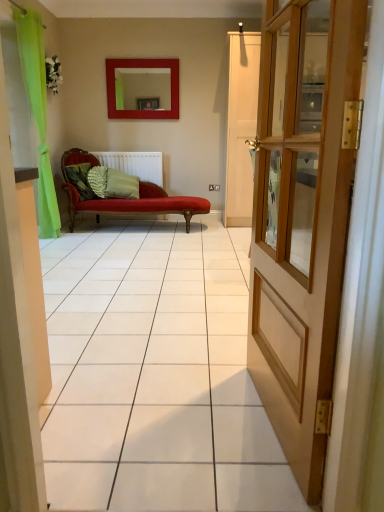
The image size is (384, 512). What do you see at coordinates (135, 164) in the screenshot?
I see `white matte radiator at center` at bounding box center [135, 164].

Image resolution: width=384 pixels, height=512 pixels. What do you see at coordinates (80, 180) in the screenshot?
I see `camouflage fabric pillow at center, the 1th pillow from the left` at bounding box center [80, 180].

Where is `matte red mirror at upper center`? This screenshot has height=512, width=384. matte red mirror at upper center is located at coordinates (142, 67).

What do you see at coordinates (142, 67) in the screenshot? This screenshot has width=384, height=512. I see `matte red mirror at upper center` at bounding box center [142, 67].

What do you see at coordinates (303, 217) in the screenshot? The height and width of the screenshot is (512, 384). I see `wooden door at right` at bounding box center [303, 217].

The width and height of the screenshot is (384, 512). Find the location of `white matte radiator at center`. white matte radiator at center is located at coordinates (135, 164).

The height and width of the screenshot is (512, 384). Find the location of `pillow that is the 3rd object to the left of the wooden door at right, starting at the anchor`. pillow that is the 3rd object to the left of the wooden door at right, starting at the anchor is located at coordinates (80, 180).

Visually, is wooden door at right positioned to the left or to the right of camouflage fabric pillow at center, which appears as the third pillow when viewed from the right?

Clearly, wooden door at right is on the right of camouflage fabric pillow at center, which appears as the third pillow when viewed from the right, in the image.

Does wooden door at right contain camouflage fabric pillow at center, the 1th pillow from the left?

No, wooden door at right does not contain camouflage fabric pillow at center, the 1th pillow from the left.

In the scene shown: Considering the sizes of objects wooden door at right and camouflage fabric pillow at center, which appears as the third pillow when viewed from the right, in the image provided, who is wider, wooden door at right or camouflage fabric pillow at center, which appears as the third pillow when viewed from the right,?

camouflage fabric pillow at center, which appears as the third pillow when viewed from the right.

At what (x,y) coordinates should I click in order to perform the action: click on pillow behind the green textured pillow at center, the second pillow from the left. Please return your answer as a coordinate pair (x, y). Image resolution: width=384 pixels, height=512 pixels. Looking at the image, I should click on (121, 185).

From a real-world perspective, is green textured pillow at center, the second pillow in the right-to-left sequence, on green fabric pillow at center, the first pillow in the right-to-left sequence?

No.

Does green textured pillow at center, the second pillow from the left, come in front of green fabric pillow at center, positioned as the 3th pillow in left-to-right order?

Yes, it is in front of green fabric pillow at center, positioned as the 3th pillow in left-to-right order.

How many degrees apart are the facing directions of green textured pillow at center, the second pillow from the left, and green fabric pillow at center, positioned as the 3th pillow in left-to-right order?

They differ by 40.8 degrees in their facing directions.

Is matte red mirror at upper center bigger or smaller than green fabric pillow at center, positioned as the 3th pillow in left-to-right order?

matte red mirror at upper center is smaller than green fabric pillow at center, positioned as the 3th pillow in left-to-right order.

Which of these two, matte red mirror at upper center or green fabric pillow at center, positioned as the 3th pillow in left-to-right order, stands shorter?

green fabric pillow at center, positioned as the 3th pillow in left-to-right order, is shorter.

Is matte red mirror at upper center facing towards green fabric pillow at center, positioned as the 3th pillow in left-to-right order?

No, matte red mirror at upper center is not aimed at green fabric pillow at center, positioned as the 3th pillow in left-to-right order.

Would you say green fabric pillow at center, positioned as the 3th pillow in left-to-right order, is part of matte red mirror at upper center's contents?

No, green fabric pillow at center, positioned as the 3th pillow in left-to-right order, is not a part of matte red mirror at upper center.

In the image, is white matte radiator at center positioned in front of or behind matte red mirror at upper center?

Visually, white matte radiator at center is located behind matte red mirror at upper center.

You are a GUI agent. You are given a task and a screenshot of the screen. Output one action in this format:
    pyautogui.click(x=<x>, y=<y>)
    Task: Click on the mirror on the right of white matte radiator at center
    The width and height of the screenshot is (384, 512).
    Given the screenshot: What is the action you would take?
    pyautogui.click(x=142, y=67)

Is white matte radiator at center with matte red mirror at upper center?

white matte radiator at center and matte red mirror at upper center are clearly separated.

From the image's perspective, would you say green fabric pillow at center, the first pillow in the right-to-left sequence, is shown under white matte radiator at center?

Yes.

Could you tell me if green fabric pillow at center, positioned as the 3th pillow in left-to-right order, is turned towards white matte radiator at center?

No, green fabric pillow at center, positioned as the 3th pillow in left-to-right order, is not oriented towards white matte radiator at center.

Does green fabric pillow at center, positioned as the 3th pillow in left-to-right order, come behind white matte radiator at center?

No, green fabric pillow at center, positioned as the 3th pillow in left-to-right order, is in front of white matte radiator at center.

From their relative heights in the image, would you say green fabric pillow at center, positioned as the 3th pillow in left-to-right order, is taller or shorter than camouflage fabric pillow at center, the 1th pillow from the left?

In the image, green fabric pillow at center, positioned as the 3th pillow in left-to-right order, appears to be taller than camouflage fabric pillow at center, the 1th pillow from the left.

Does green fabric pillow at center, the first pillow in the right-to-left sequence, have a greater width compared to camouflage fabric pillow at center, which appears as the third pillow when viewed from the right?

Yes, green fabric pillow at center, the first pillow in the right-to-left sequence, is wider than camouflage fabric pillow at center, which appears as the third pillow when viewed from the right.

Is green fabric pillow at center, positioned as the 3th pillow in left-to-right order, bigger or smaller than camouflage fabric pillow at center, which appears as the third pillow when viewed from the right?

In the image, green fabric pillow at center, positioned as the 3th pillow in left-to-right order, appears to be larger than camouflage fabric pillow at center, which appears as the third pillow when viewed from the right.

Is green fabric pillow at center, positioned as the 3th pillow in left-to-right order, facing away from camouflage fabric pillow at center, which appears as the third pillow when viewed from the right?

green fabric pillow at center, positioned as the 3th pillow in left-to-right order, is not turned away from camouflage fabric pillow at center, which appears as the third pillow when viewed from the right.

Who is shorter, white matte radiator at center or green fabric pillow at center, the first pillow in the right-to-left sequence?

Standing shorter between the two is white matte radiator at center.

How much distance is there between white matte radiator at center and green fabric pillow at center, the first pillow in the right-to-left sequence?

The distance of white matte radiator at center from green fabric pillow at center, the first pillow in the right-to-left sequence, is 13.20 inches.

Is white matte radiator at center oriented towards green fabric pillow at center, the first pillow in the right-to-left sequence?

Yes.

Considering the sizes of objects white matte radiator at center and green fabric pillow at center, the first pillow in the right-to-left sequence, in the image provided, who is smaller, white matte radiator at center or green fabric pillow at center, the first pillow in the right-to-left sequence,?

Smaller between the two is white matte radiator at center.

This screenshot has height=512, width=384. I want to click on door in front of the camouflage fabric pillow at center, which appears as the third pillow when viewed from the right, so click(303, 217).

Locate an element on the screen. The width and height of the screenshot is (384, 512). pillow on the right of green textured pillow at center, the second pillow from the left is located at coordinates (121, 185).

Looking at this image, when comparing their distances from camouflage fabric pillow at center, the 1th pillow from the left, does green fabric pillow at center, the first pillow in the right-to-left sequence, or green textured pillow at center, the second pillow in the right-to-left sequence, seem further?

The object further to camouflage fabric pillow at center, the 1th pillow from the left, is green fabric pillow at center, the first pillow in the right-to-left sequence.

Which object lies nearer to the anchor point green fabric pillow at center, positioned as the 3th pillow in left-to-right order, green textured pillow at center, the second pillow in the right-to-left sequence, or matte red mirror at upper center?

Based on the image, green textured pillow at center, the second pillow in the right-to-left sequence, appears to be nearer to green fabric pillow at center, positioned as the 3th pillow in left-to-right order.

When comparing their distances from green textured pillow at center, the second pillow in the right-to-left sequence, does white matte radiator at center or green fabric pillow at center, positioned as the 3th pillow in left-to-right order, seem closer?

green fabric pillow at center, positioned as the 3th pillow in left-to-right order, is positioned closer to the anchor green textured pillow at center, the second pillow in the right-to-left sequence.

Which object lies nearer to the anchor point green fabric pillow at center, positioned as the 3th pillow in left-to-right order, camouflage fabric pillow at center, the 1th pillow from the left, or matte red mirror at upper center?

camouflage fabric pillow at center, the 1th pillow from the left, lies closer to green fabric pillow at center, positioned as the 3th pillow in left-to-right order, than the other object.

Estimate the real-world distances between objects in this image. Which object is further from wooden door at right, matte red mirror at upper center or white matte radiator at center?

matte red mirror at upper center is further to wooden door at right.

Which object lies nearer to the anchor point green textured pillow at center, the second pillow in the right-to-left sequence, matte red mirror at upper center or green fabric pillow at center, the first pillow in the right-to-left sequence?

green fabric pillow at center, the first pillow in the right-to-left sequence, is positioned closer to the anchor green textured pillow at center, the second pillow in the right-to-left sequence.

Based on their spatial positions, is wooden door at right or green fabric pillow at center, positioned as the 3th pillow in left-to-right order, further from camouflage fabric pillow at center, which appears as the third pillow when viewed from the right?

wooden door at right is further to camouflage fabric pillow at center, which appears as the third pillow when viewed from the right.

From the image, which object appears to be farther from white matte radiator at center, green fabric pillow at center, positioned as the 3th pillow in left-to-right order, or matte red mirror at upper center?

The object further to white matte radiator at center is matte red mirror at upper center.

You are a GUI agent. You are given a task and a screenshot of the screen. Output one action in this format:
    pyautogui.click(x=<x>, y=<y>)
    Task: Click on the pillow between matte red mirror at upper center and green textured pillow at center, the second pillow from the left, in the up-down direction
    
    Given the screenshot: What is the action you would take?
    pyautogui.click(x=121, y=185)

What are the coordinates of `pillow located between camouflage fabric pillow at center, the 1th pillow from the left, and green fabric pillow at center, the first pillow in the right-to-left sequence, in the left-right direction` in the screenshot? It's located at (98, 180).

I want to click on radiator between matte red mirror at upper center and green textured pillow at center, the second pillow in the right-to-left sequence, in the up-down direction, so [x=135, y=164].

Locate an element on the screen. This screenshot has height=512, width=384. pillow positioned between green textured pillow at center, the second pillow from the left, and white matte radiator at center from near to far is located at coordinates (121, 185).